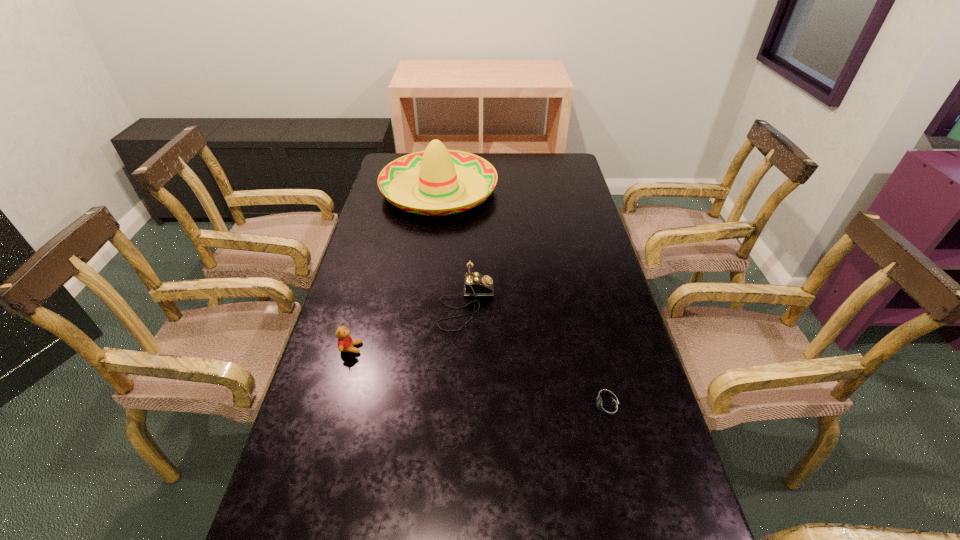
Locate an element on the screen. The width and height of the screenshot is (960, 540). sombrero is located at coordinates (437, 170).

Identify the location of the farthest object. The height and width of the screenshot is (540, 960). [437, 170].

At what (x,y) coordinates should I click in order to perform the action: click on telephone. Please return your answer as a coordinate pair (x, y). Looking at the image, I should click on (476, 284).

Identify the location of the third farthest object. (345, 343).

The width and height of the screenshot is (960, 540). In order to click on watch in this screenshot , I will do `click(607, 407)`.

At what (x,y) coordinates should I click in order to perform the action: click on the shortest object. Please return your answer as a coordinate pair (x, y). Looking at the image, I should click on point(607,407).

Identify the location of vacant point located 0.080m on the back of the farthest object. (444, 154).

Find the location of a particular element. The height and width of the screenshot is (540, 960). free space located on the dial of the telephone is located at coordinates (604, 305).

Locate an element on the screen. This screenshot has height=540, width=960. blank area located on the front-facing side of the second nearest object is located at coordinates (490, 348).

You are a GUI agent. You are given a task and a screenshot of the screen. Output one action in this format:
    pyautogui.click(x=<x>, y=<y>)
    Task: Click on the free region located 0.330m on the face of the watch
    The image size is (960, 540).
    Given the screenshot: What is the action you would take?
    click(x=443, y=407)